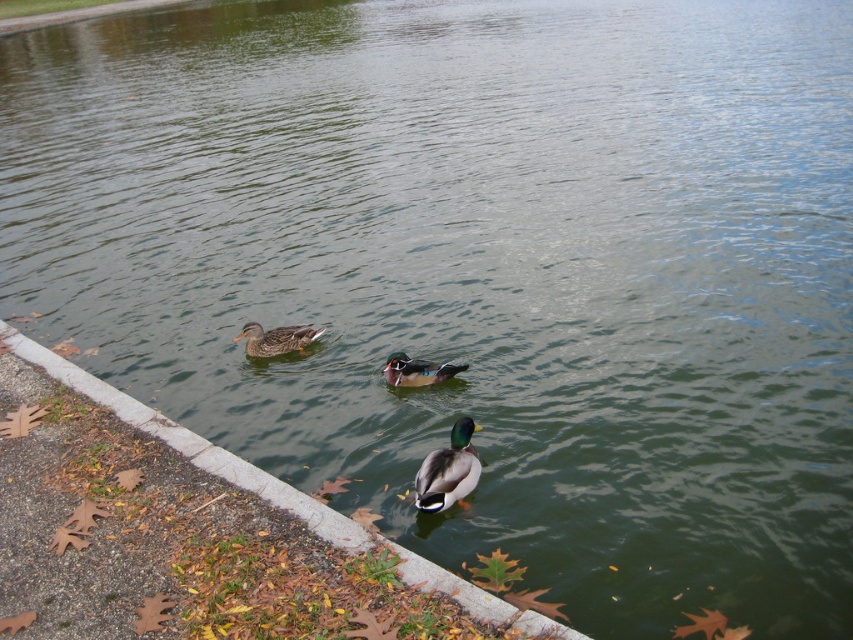
Is green glossy duck at center closer to the viewer compared to shiny brown wood duck at center?

No, green glossy duck at center is further to the viewer.

What are the coordinates of `green glossy duck at center` in the screenshot? It's located at (276, 339).

Is point (421, 588) positioned before point (422, 499)?

Yes, it is in front of point (422, 499).

Is gray concrete curb at lower left above green iridescent duck at center?

Indeed, gray concrete curb at lower left is positioned over green iridescent duck at center.

Is point (502, 611) farther from viewer compared to point (465, 461)?

No, it is not.

Image resolution: width=853 pixels, height=640 pixels. Identify the location of gray concrete curb at lower left. (279, 492).

Between point (456, 442) and point (393, 374), which one is positioned in front?

Positioned in front is point (456, 442).

I want to click on green iridescent duck at center, so click(x=448, y=470).